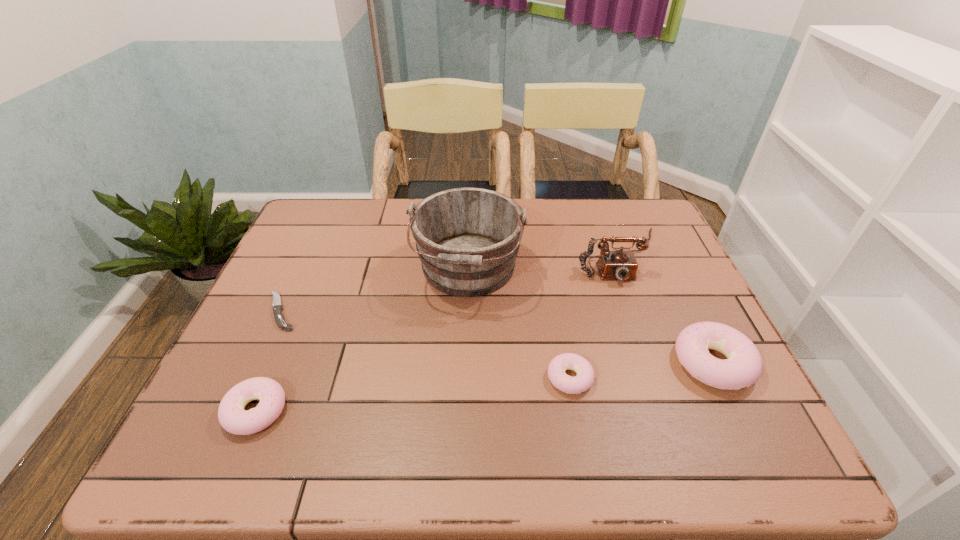
To ensure equal spacing by inserting another doughnut among them, please point out a vacant spot for this new doughnut. Please provide its 2D coordinates. Your answer should be formatted as a tuple, i.e. [(x, y)], where the tuple contains the x and y coordinates of a point satisfying the conditions above.

[(418, 394)]